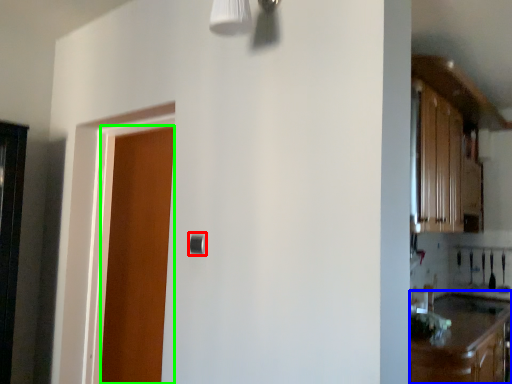
Question: Estimate the real-world distances between objects in this image. Which object is closer to door handle (highlighted by a red box), cabinetry (highlighted by a blue box) or door (highlighted by a green box)?

Choices:
 (A) cabinetry
 (B) door

Answer: (B)